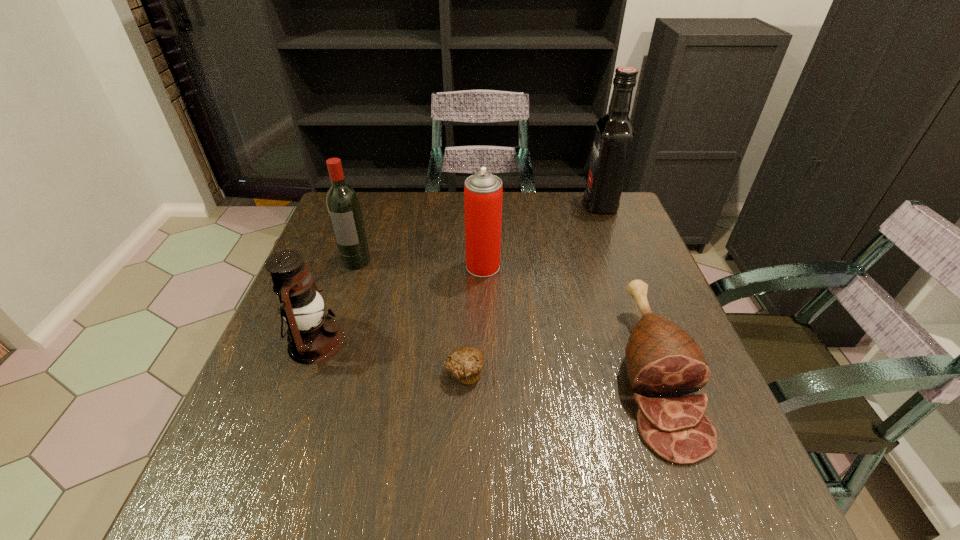
Where is `free spot located 0.290m on the label of the wine bottle`? The height and width of the screenshot is (540, 960). free spot located 0.290m on the label of the wine bottle is located at coordinates (323, 361).

Find the location of a particular element. vacant space situated 0.320m on the right of the aerosol can is located at coordinates (624, 266).

Identify the location of free space located 0.310m on the side of the lantern, there is a wick adjustment knob. Image resolution: width=960 pixels, height=540 pixels. (489, 342).

At what (x,y) coordinates should I click in order to perform the action: click on free space located 0.150m on the back of the muffin. Please return your answer as a coordinate pair (x, y). Image resolution: width=960 pixels, height=540 pixels. Looking at the image, I should click on (467, 306).

The width and height of the screenshot is (960, 540). In order to click on object that is at the far edge in this screenshot , I will do `click(614, 134)`.

The width and height of the screenshot is (960, 540). Identify the location of wine bottle at the left edge. (343, 205).

Identify the location of lantern present at the left edge. This screenshot has height=540, width=960. (313, 337).

Find the location of a particular element. liquor present at the right edge is located at coordinates (614, 134).

Find the location of a particular element. The image size is (960, 540). ham that is at the right edge is located at coordinates (663, 360).

You are a GUI agent. You are given a task and a screenshot of the screen. Output one action in this format:
    pyautogui.click(x=<x>, y=<y>)
    Task: Click on the object present at the far right corner
    Image resolution: width=960 pixels, height=540 pixels.
    Given the screenshot: What is the action you would take?
    pyautogui.click(x=614, y=134)